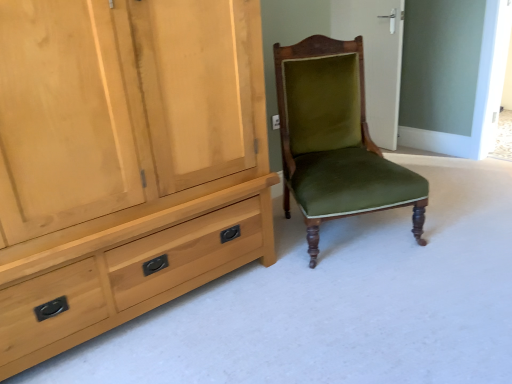
Locate an element on the screen. The image size is (512, 384). unoccupied region to the right of light wood cabinet at left is located at coordinates (338, 306).